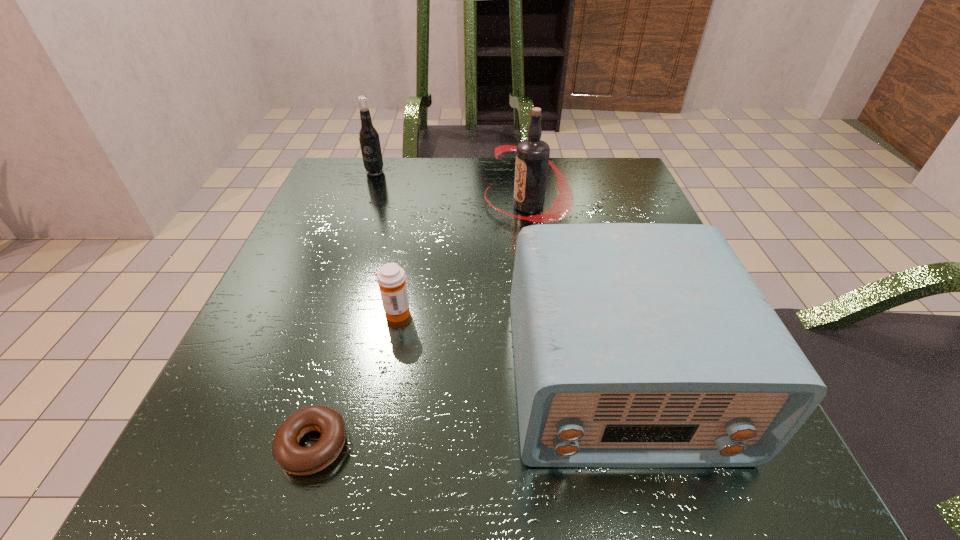
You are a GUI agent. You are given a task and a screenshot of the screen. Output one action in this format:
    pyautogui.click(x=<x>, y=<y>)
    Task: Click on the right root beer
    This screenshot has height=540, width=960.
    Given the screenshot: What is the action you would take?
    pyautogui.click(x=532, y=155)

The image size is (960, 540). I want to click on the tallest object, so click(532, 155).

Find the location of a particular element. This screenshot has height=540, width=960. the farther root beer is located at coordinates (369, 140).

You are a GUI agent. You are given a task and a screenshot of the screen. Output one action in this format:
    pyautogui.click(x=<x>, y=<y>)
    Task: Click on the left root beer
    The width and height of the screenshot is (960, 540).
    Given the screenshot: What is the action you would take?
    pyautogui.click(x=369, y=140)

Where is `radio receiver`? radio receiver is located at coordinates (636, 345).

I want to click on the fourth tallest object, so click(391, 278).

In order to click on the third object from left to right in this screenshot , I will do `click(391, 278)`.

I want to click on doughnut, so click(x=288, y=454).

Find the location of `free region located on the label of the taller root beer`. free region located on the label of the taller root beer is located at coordinates (327, 206).

You are a GUI agent. You are given a task and a screenshot of the screen. Output one action in this format:
    pyautogui.click(x=<x>, y=<y>)
    Task: Click on the vacant space positioned on the label of the taller root beer
    The width and height of the screenshot is (960, 540).
    Given the screenshot: What is the action you would take?
    pyautogui.click(x=452, y=206)